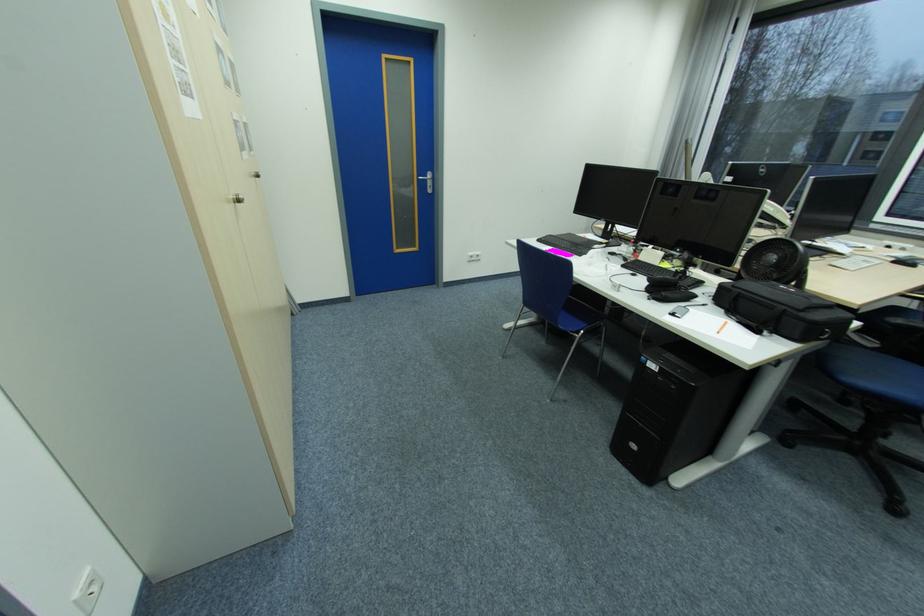
What do you see at coordinates (428, 180) in the screenshot?
I see `the metal door handle` at bounding box center [428, 180].